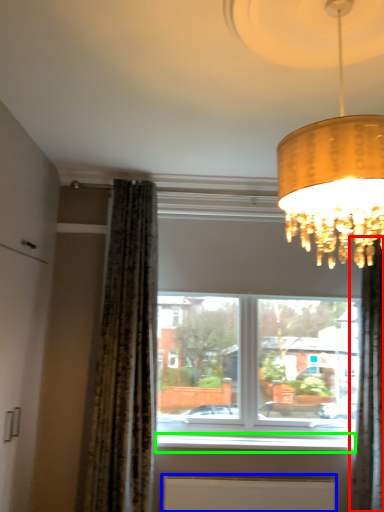
Question: Based on their relative distances, which object is nearer to curtain (highlighted by a red box)? Choose from radiator (highlighted by a blue box) and window sill (highlighted by a green box).

Choices:
 (A) radiator
 (B) window sill

Answer: (B)